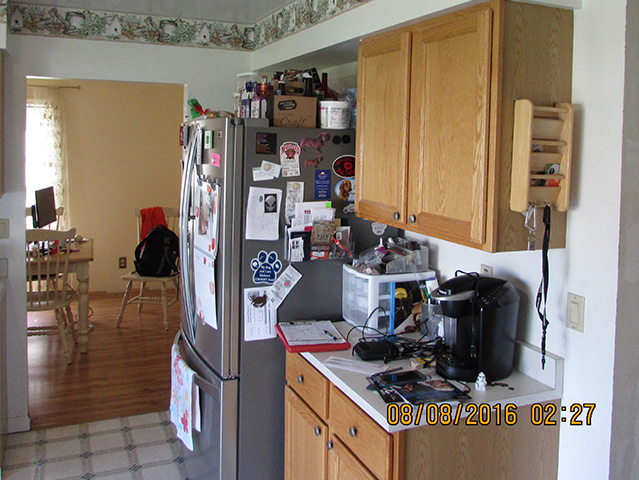
Identify the location of outlet. (488, 271), (121, 261).